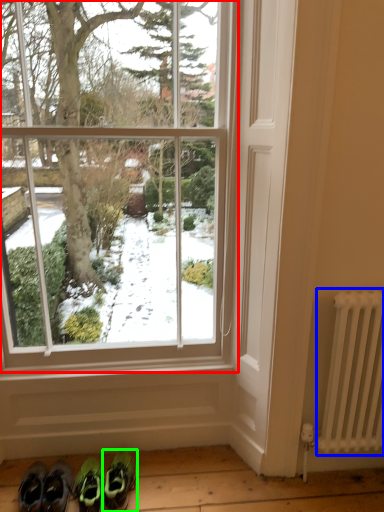
Question: Which object is positioned farthest from window (highlighted by a red box)? Select from radiator (highlighted by a blue box) and footwear (highlighted by a green box).

Choices:
 (A) radiator
 (B) footwear

Answer: (B)